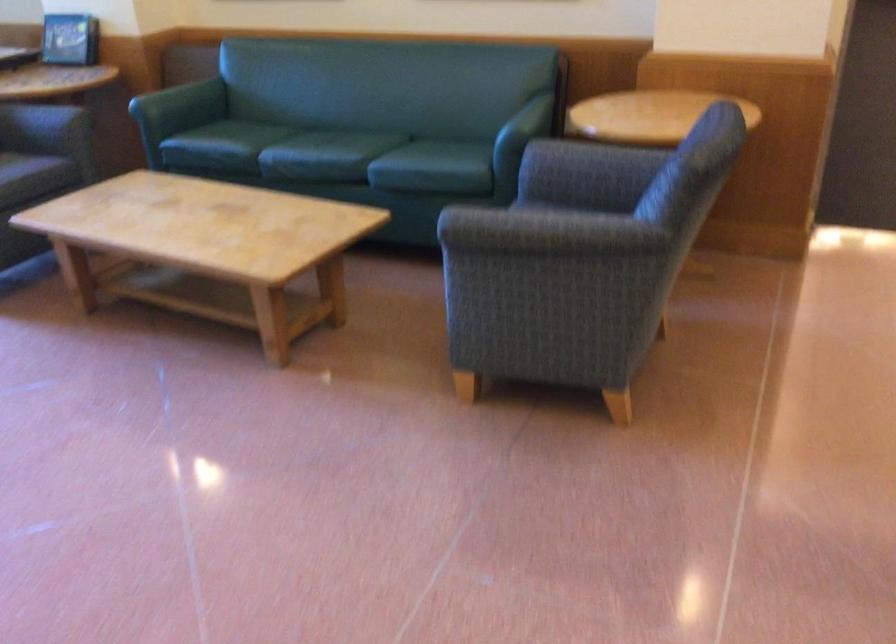
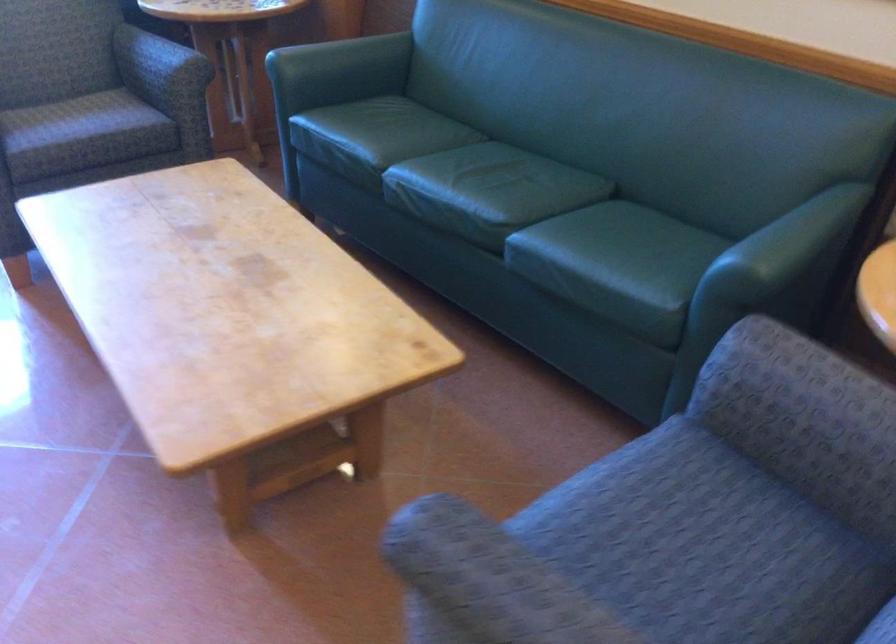
Question: Which direction would the cameraman need to move to produce the second image? Reply with the corresponding letter.

Choices:
 (A) Left
 (B) Right
 (C) Forward
 (D) Backward

Answer: (C)